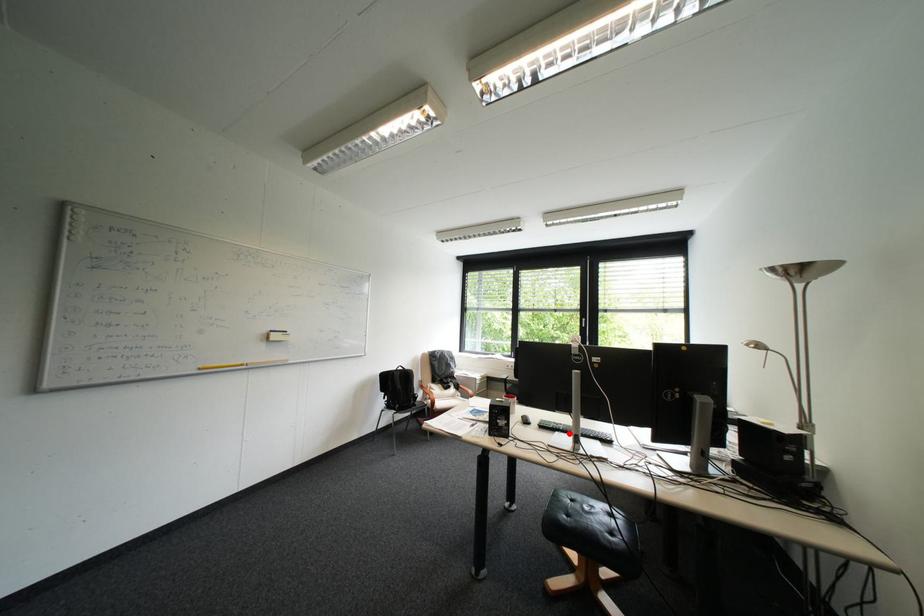
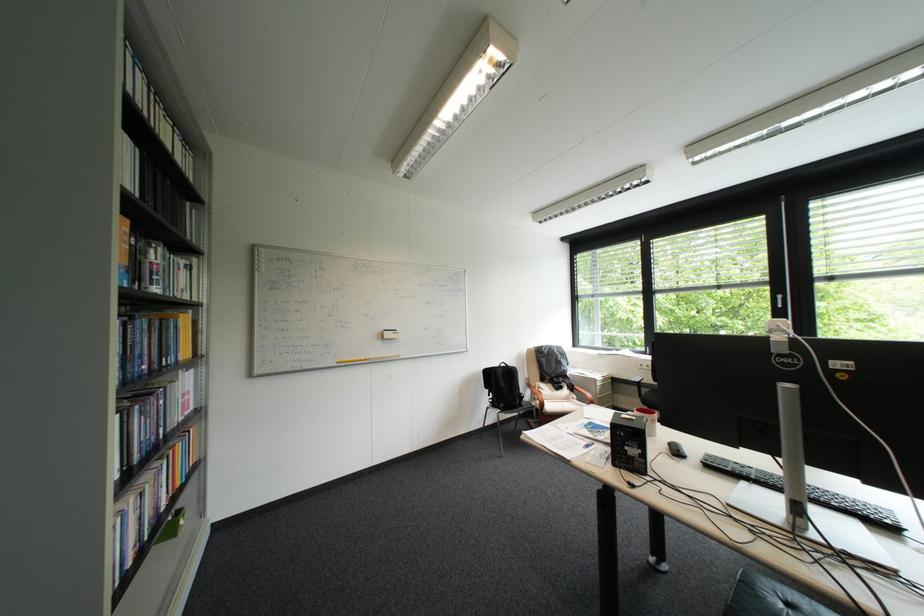
Locate, in the second image, the point that corresponds to the highlighted location in the first image.

(757, 484)